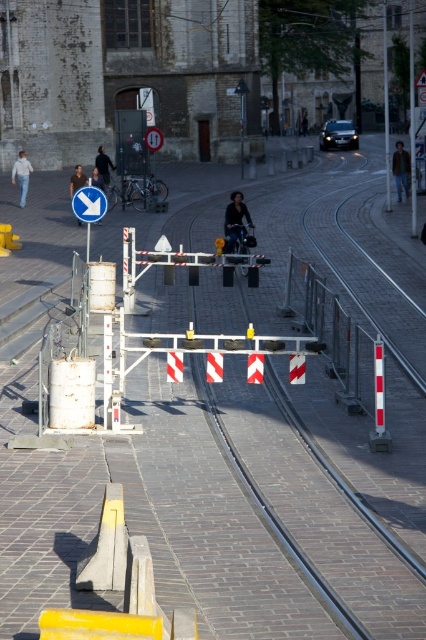
Question: Can you confirm if dark blue leather jacket at center is thinner than matte blue sign at upper left?

Choices:
 (A) no
 (B) yes

Answer: (B)

Question: Considering the relative positions of dark brown leather jacket at upper center and dark brown leather jacket at center in the image provided, where is dark brown leather jacket at upper center located with respect to dark brown leather jacket at center?

Choices:
 (A) right
 (B) left

Answer: (A)

Question: Does dark blue leather jacket at center appear under metallic pole at center?

Choices:
 (A) yes
 (B) no

Answer: (A)

Question: Which object appears farthest from the camera in this image?

Choices:
 (A) dark blue jacket at center
 (B) dark brown leather jacket at center
 (C) matte blue sign at upper left

Answer: (A)

Question: Which object is closer to the camera taking this photo?

Choices:
 (A) matte blue sign at upper left
 (B) dark blue jacket at center

Answer: (A)

Question: Which point is farther to the camera?

Choices:
 (A) metallic pole at center
 (B) metallic pole at upper right

Answer: (A)